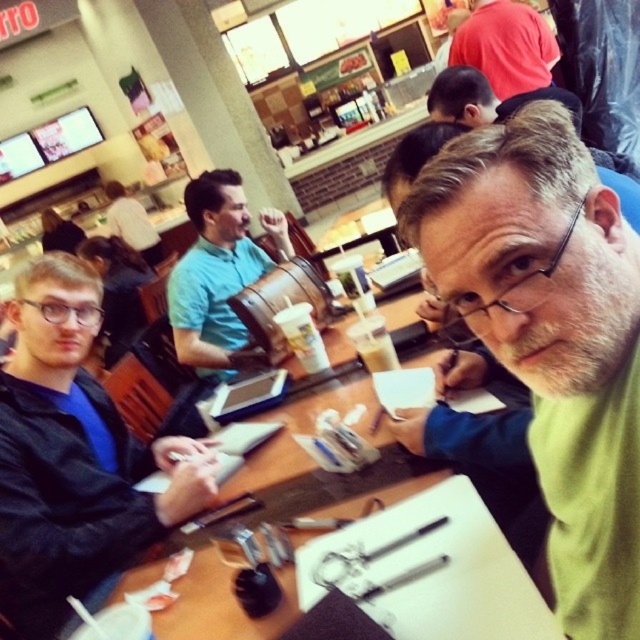
Question: Which object appears farthest from the camera in this image?

Choices:
 (A) teal matte shirt at center
 (B) smooth brown leather jacket at upper center
 (C) matte red shirt at upper center

Answer: (C)

Question: In this image, where is matte red shirt at upper center located relative to smooth brown leather jacket at upper center?

Choices:
 (A) left
 (B) right

Answer: (B)

Question: Does green matte shirt at center have a larger size compared to matte red shirt at upper center?

Choices:
 (A) no
 (B) yes

Answer: (A)

Question: Where is matte red shirt at upper center located in relation to smooth brown leather jacket at upper center in the image?

Choices:
 (A) right
 (B) left

Answer: (A)

Question: Which point is farther to the camera?

Choices:
 (A) (492, 67)
 (B) (156, 440)

Answer: (A)

Question: Which of the following is the closest to the observer?

Choices:
 (A) matte red shirt at upper center
 (B) green matte shirt at center

Answer: (B)